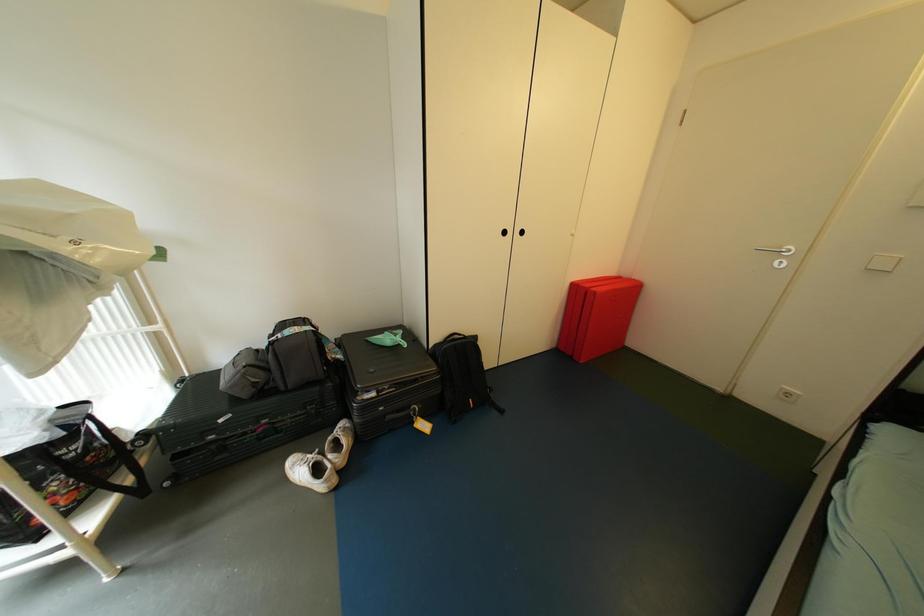
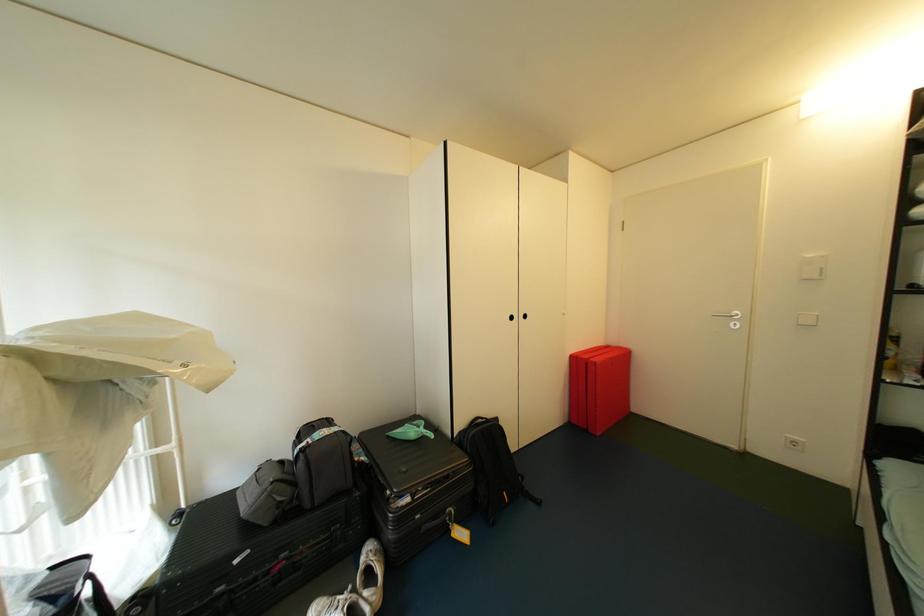
The images are taken continuously from a first-person perspective. In which direction are you moving?

The cameraman moved toward left, backward.